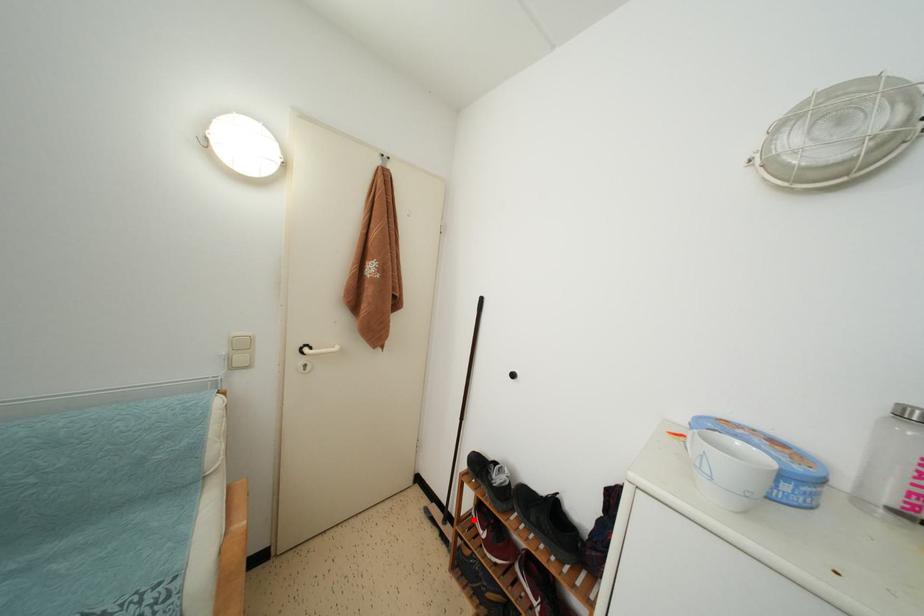
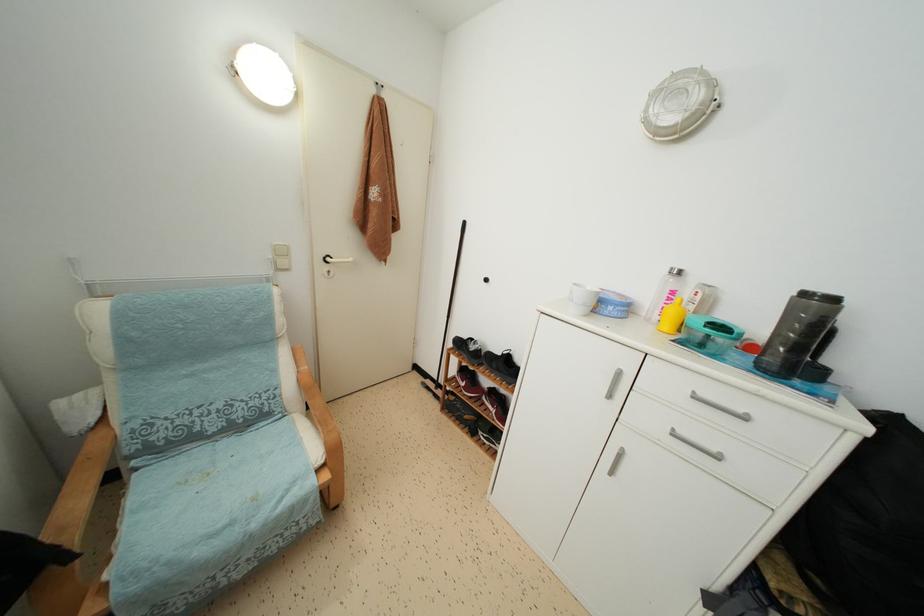
Question: I am providing you with two images of the same scene from different viewpoints. Image1 has a red point marked. In image2, the corresponding 3D location appears at what relative position? Reply with the corresponding letter.

Choices:
 (A) Closer
 (B) Farther

Answer: (A)